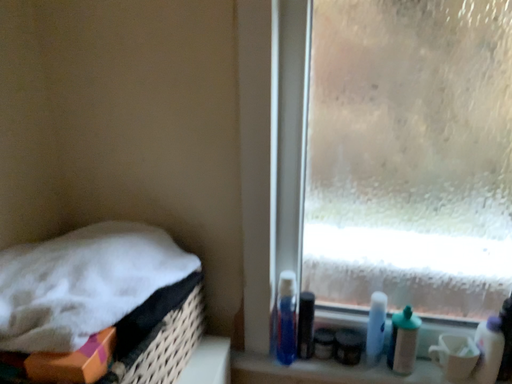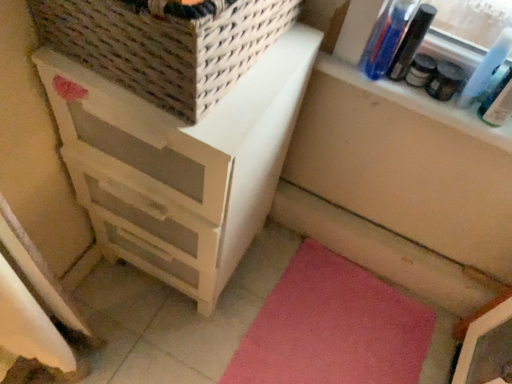
Question: Which way did the camera rotate in the video?

Choices:
 (A) rotated downward
 (B) rotated upward

Answer: (A)